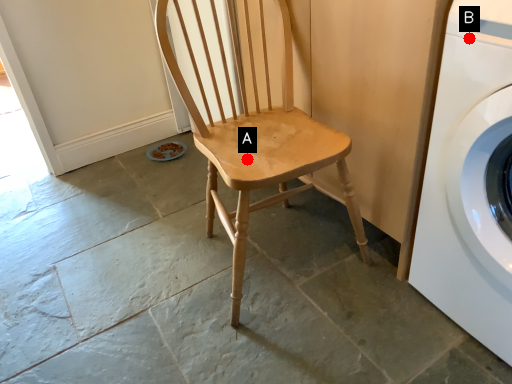
Question: Two points are circled on the image, labeled by A and B beside each circle. Which point is farther from the camera taking this photo?

Choices:
 (A) A is further
 (B) B is further

Answer: (A)